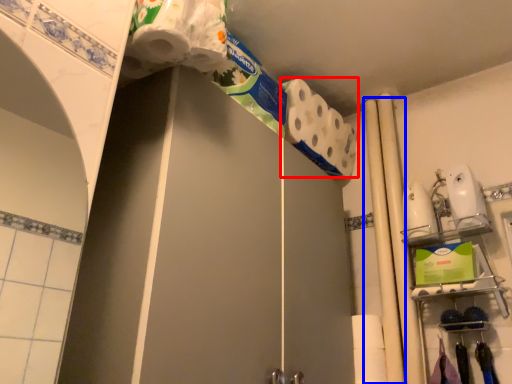
Question: Which object appears farthest to the camera in this image, toilet paper (highlighted by a red box) or beam (highlighted by a blue box)?

Choices:
 (A) toilet paper
 (B) beam

Answer: (A)